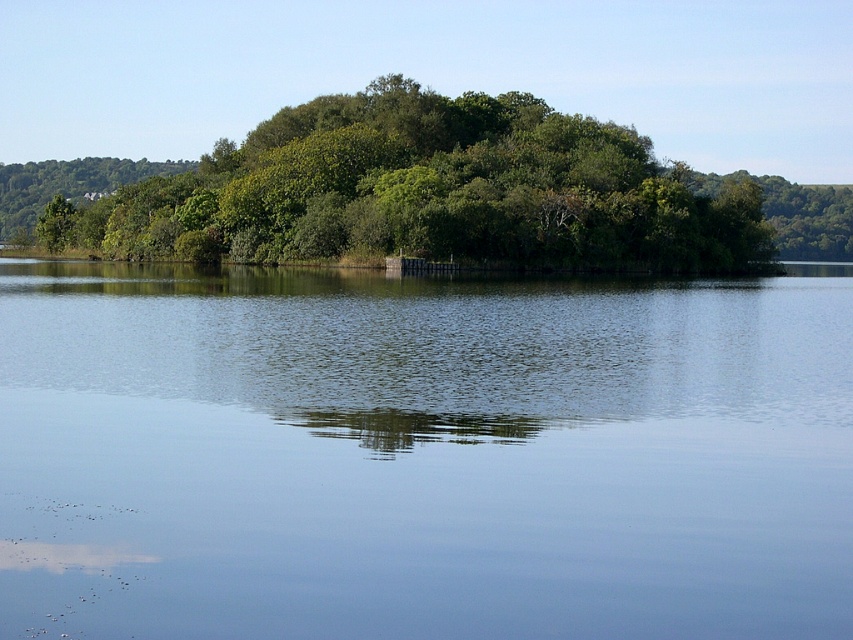
You are a bird flying over the landscape. You see the transparent water at center and the green leafy trees at center. Which one is directly above the other?

The green leafy trees at center are directly above the transparent water at center because the transparent water at center is located below them.

From the picture: You are a bird flying over the serene landscape. You notice the transparent water at center and the green leafy trees at center. Which one appears taller from your perspective?

The green leafy trees at center appear taller than the transparent water at center from your perspective.

You are standing at the camera position and want to jump into the transparent water at center. Can you reach it in a single leap? Assume your maximum jump distance is 8 meters.

The transparent water at center is 8.66 meters away from the camera, which is beyond your maximum jump distance of 8 meters. You cannot reach it in a single leap.